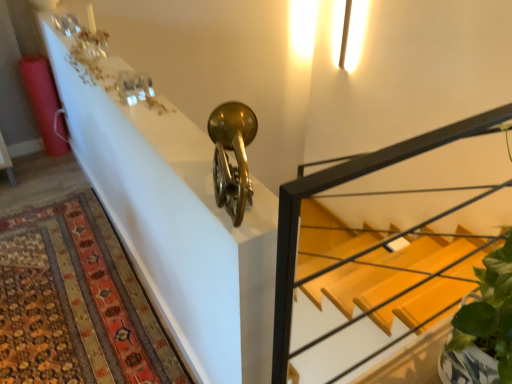
Question: Is wooden stairs at center located outside metallic gold trumpet at upper center?

Choices:
 (A) no
 (B) yes

Answer: (B)

Question: Is wooden stairs at center oriented towards metallic gold trumpet at upper center?

Choices:
 (A) yes
 (B) no

Answer: (B)

Question: From the image's perspective, is wooden stairs at center on top of metallic gold trumpet at upper center?

Choices:
 (A) no
 (B) yes

Answer: (A)

Question: From a real-world perspective, is wooden stairs at center physically above metallic gold trumpet at upper center?

Choices:
 (A) no
 (B) yes

Answer: (A)

Question: Is wooden stairs at center placed right next to metallic gold trumpet at upper center?

Choices:
 (A) no
 (B) yes

Answer: (A)

Question: Considering the relative positions of wooden stairs at center and metallic gold trumpet at upper center in the image provided, is wooden stairs at center in front of metallic gold trumpet at upper center?

Choices:
 (A) yes
 (B) no

Answer: (A)

Question: Are carpeted rug at lower left and wooden stairs at center making contact?

Choices:
 (A) no
 (B) yes

Answer: (A)

Question: Would you say carpeted rug at lower left is a long distance from wooden stairs at center?

Choices:
 (A) yes
 (B) no

Answer: (A)

Question: Is carpeted rug at lower left wider than wooden stairs at center?

Choices:
 (A) no
 (B) yes

Answer: (B)

Question: Considering the relative sizes of carpeted rug at lower left and wooden stairs at center in the image provided, is carpeted rug at lower left bigger than wooden stairs at center?

Choices:
 (A) no
 (B) yes

Answer: (A)

Question: From the image's perspective, is carpeted rug at lower left under wooden stairs at center?

Choices:
 (A) no
 (B) yes

Answer: (B)

Question: Does carpeted rug at lower left appear on the right side of wooden stairs at center?

Choices:
 (A) no
 (B) yes

Answer: (A)

Question: Is wooden stairs at center completely or partially inside metallic gold trumpet at upper center?

Choices:
 (A) no
 (B) yes

Answer: (A)